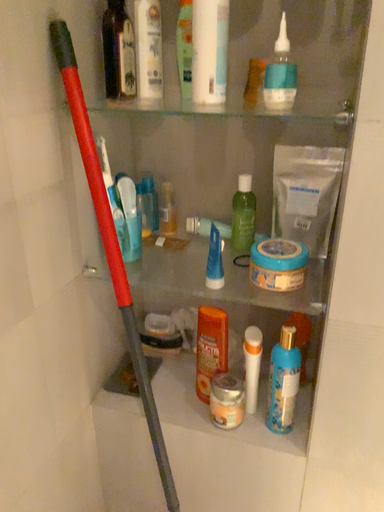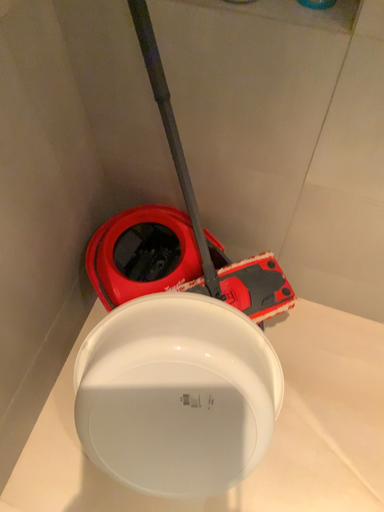
Question: How did the camera likely rotate when shooting the video?

Choices:
 (A) rotated upward
 (B) rotated downward

Answer: (B)